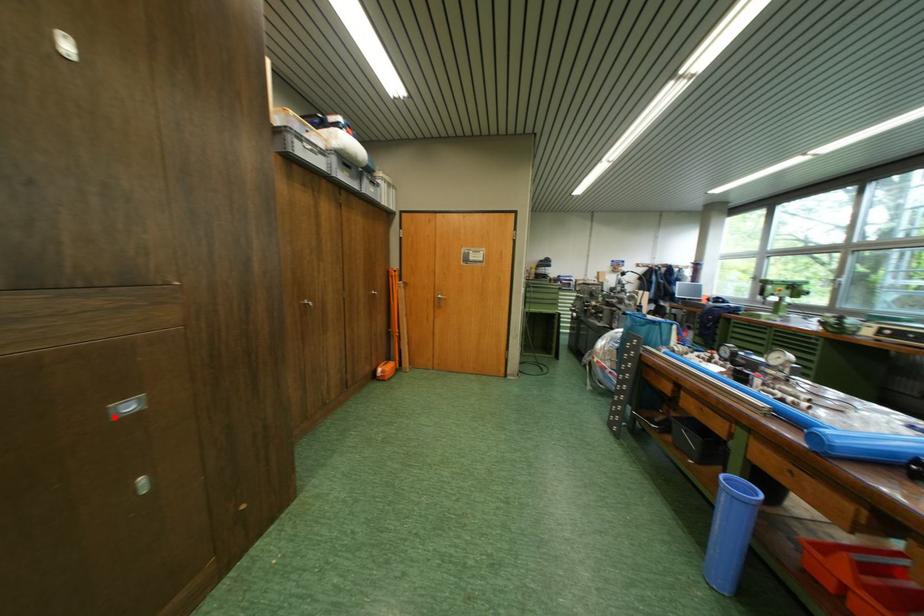
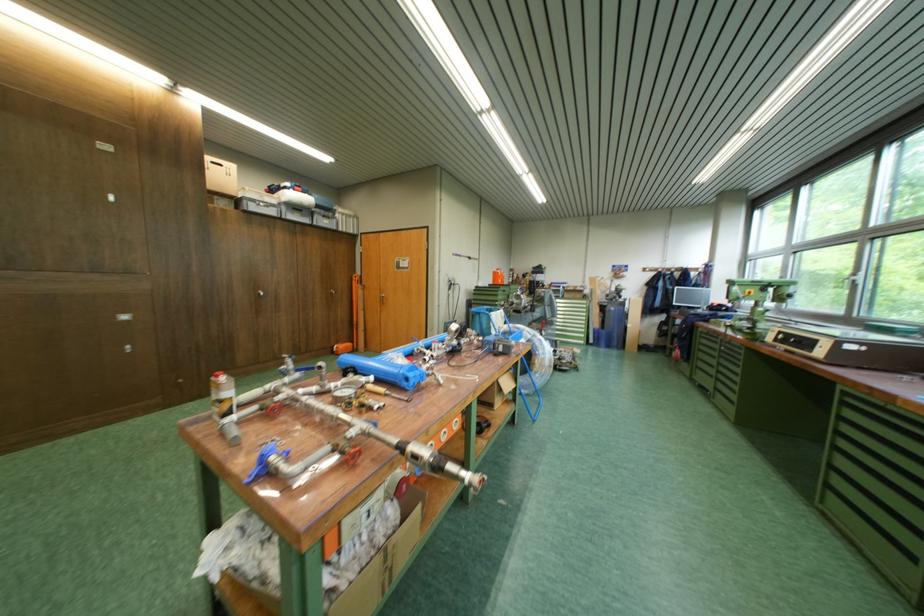
In the second image, find the point that corresponds to the highlighted location in the first image.

(127, 321)